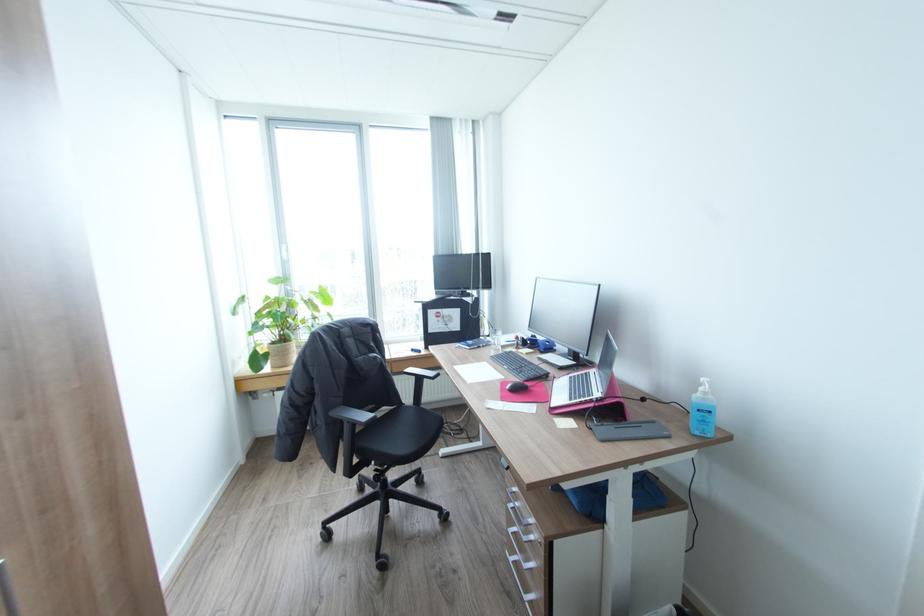
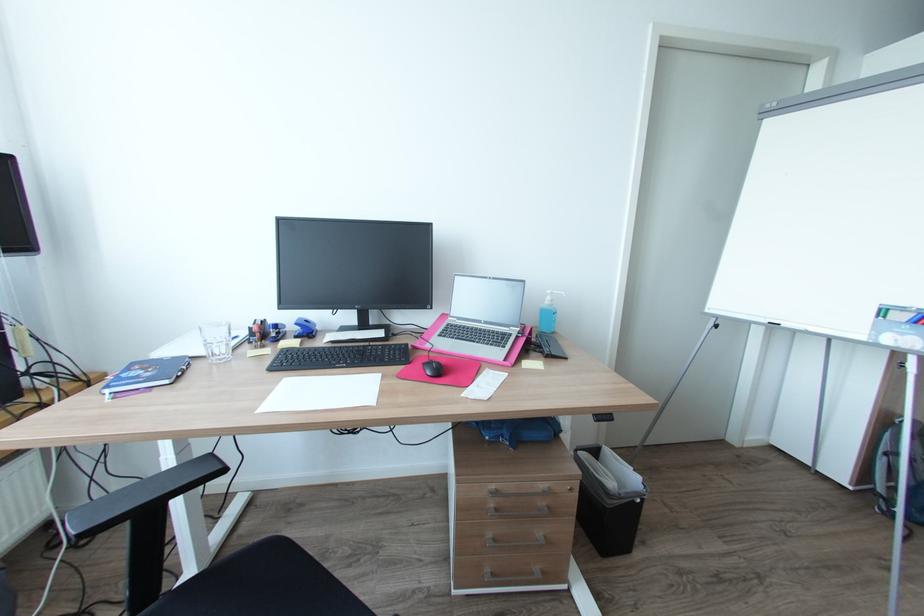
Locate, in the second image, the point that corresponds to point (519, 488) in the first image.

(497, 487)